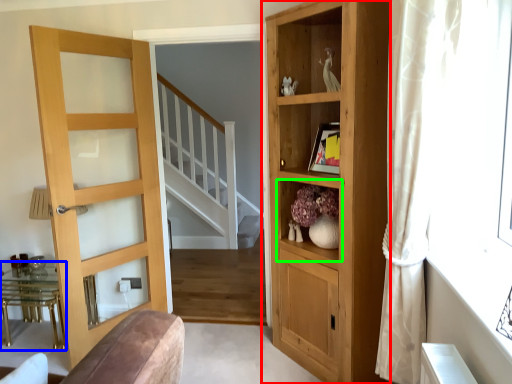
Question: Which is nearer to the cupboard (highlighted by a red box)? table (highlighted by a blue box) or shelf (highlighted by a green box).

Choices:
 (A) table
 (B) shelf

Answer: (B)